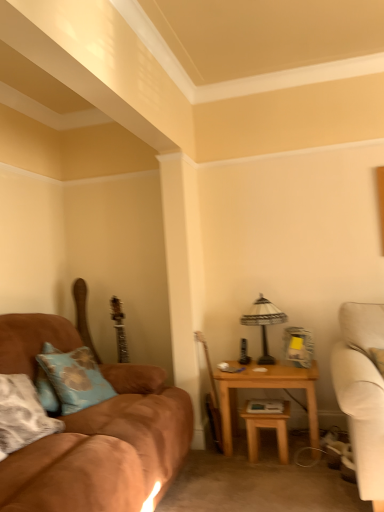
Question: Is the position of suede brown couch at left more distant than that of wooden table at right, which is the second table in right-to-left order?

Choices:
 (A) no
 (B) yes

Answer: (A)

Question: Is wooden table at right, which is the second table in right-to-left order, at the back of suede brown couch at left?

Choices:
 (A) yes
 (B) no

Answer: (B)

Question: Can we say suede brown couch at left lies outside wooden table at right, arranged as the first table when viewed from the left?

Choices:
 (A) no
 (B) yes

Answer: (B)

Question: Can you see suede brown couch at left touching wooden table at right, arranged as the first table when viewed from the left?

Choices:
 (A) yes
 (B) no

Answer: (B)

Question: Does suede brown couch at left have a lesser width compared to wooden table at right, which is the second table in right-to-left order?

Choices:
 (A) no
 (B) yes

Answer: (A)

Question: Can you confirm if suede brown couch at left is taller than wooden table at right, arranged as the first table when viewed from the left?

Choices:
 (A) yes
 (B) no

Answer: (A)

Question: Is wooden table at right, which is the second table in right-to-left order, bigger than white textured lampshade at right?

Choices:
 (A) yes
 (B) no

Answer: (B)

Question: Can you confirm if wooden table at right, arranged as the first table when viewed from the left, is positioned to the left of white textured lampshade at right?

Choices:
 (A) yes
 (B) no

Answer: (A)

Question: Considering the relative sizes of wooden table at right, which is the second table in right-to-left order, and white textured lampshade at right in the image provided, is wooden table at right, which is the second table in right-to-left order, thinner than white textured lampshade at right?

Choices:
 (A) no
 (B) yes

Answer: (A)

Question: Is wooden table at right, which is the second table in right-to-left order, further to the viewer compared to white textured lampshade at right?

Choices:
 (A) yes
 (B) no

Answer: (B)

Question: Can you confirm if wooden table at right, which is the second table in right-to-left order, is positioned to the right of white textured lampshade at right?

Choices:
 (A) yes
 (B) no

Answer: (B)

Question: Is wooden table at right, which is the second table in right-to-left order, taller than white textured lampshade at right?

Choices:
 (A) yes
 (B) no

Answer: (B)

Question: Would you say wooden table at right, which is the second table in right-to-left order, contains light brown wooden table at right, which ranks as the 1th table in right-to-left order?

Choices:
 (A) no
 (B) yes

Answer: (A)